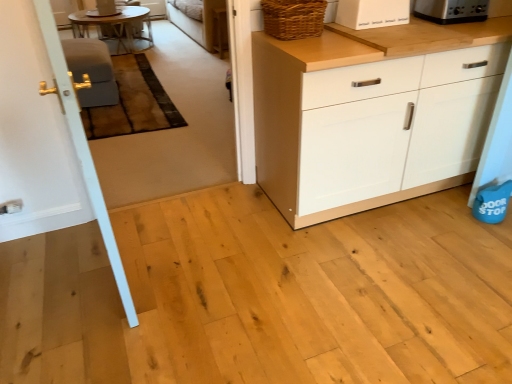
I want to click on vacant area that lies between white wood cabinet at center and white painted wood door at left, so click(234, 236).